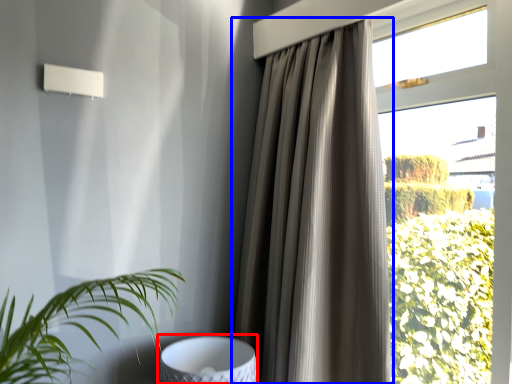
Question: Which of the following is the farthest to the observer, swivel chair (highlighted by a red box) or curtain (highlighted by a blue box)?

Choices:
 (A) swivel chair
 (B) curtain

Answer: (A)